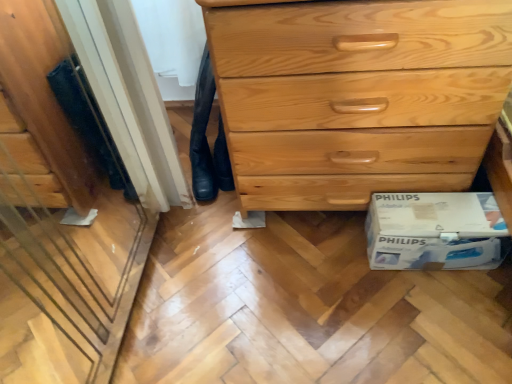
Question: Is white cardboard box at lower right turned away from black leather jeans at lower center?

Choices:
 (A) no
 (B) yes

Answer: (A)

Question: Is white cardboard box at lower right closer to the viewer compared to black leather jeans at lower center?

Choices:
 (A) no
 (B) yes

Answer: (B)

Question: Is white cardboard box at lower right not within black leather jeans at lower center?

Choices:
 (A) yes
 (B) no

Answer: (A)

Question: From a real-world perspective, is white cardboard box at lower right located beneath black leather jeans at lower center?

Choices:
 (A) no
 (B) yes

Answer: (B)

Question: Could you tell me if white cardboard box at lower right is turned towards black leather jeans at lower center?

Choices:
 (A) yes
 (B) no

Answer: (B)

Question: Visually, is light wood chest of drawers at center positioned to the left or to the right of black leather jeans at lower center?

Choices:
 (A) left
 (B) right

Answer: (B)

Question: Based on their sizes in the image, would you say light wood chest of drawers at center is bigger or smaller than black leather jeans at lower center?

Choices:
 (A) small
 (B) big

Answer: (B)

Question: From the image's perspective, is light wood chest of drawers at center located above or below black leather jeans at lower center?

Choices:
 (A) below
 (B) above

Answer: (B)

Question: Is light wood chest of drawers at center inside the boundaries of black leather jeans at lower center, or outside?

Choices:
 (A) inside
 (B) outside

Answer: (B)

Question: From their relative heights in the image, would you say white cardboard box at lower right is taller or shorter than light wood chest of drawers at center?

Choices:
 (A) short
 (B) tall

Answer: (A)

Question: Considering their positions, is white cardboard box at lower right located in front of or behind light wood chest of drawers at center?

Choices:
 (A) behind
 (B) front

Answer: (A)

Question: Which is correct: white cardboard box at lower right is inside light wood chest of drawers at center, or outside of it?

Choices:
 (A) outside
 (B) inside

Answer: (A)

Question: Based on their sizes in the image, would you say white cardboard box at lower right is bigger or smaller than light wood chest of drawers at center?

Choices:
 (A) small
 (B) big

Answer: (A)

Question: Considering the positions of black leather jeans at lower center and white cardboard box at lower right in the image, is black leather jeans at lower center wider or thinner than white cardboard box at lower right?

Choices:
 (A) wide
 (B) thin

Answer: (A)

Question: From their relative heights in the image, would you say black leather jeans at lower center is taller or shorter than white cardboard box at lower right?

Choices:
 (A) short
 (B) tall

Answer: (B)